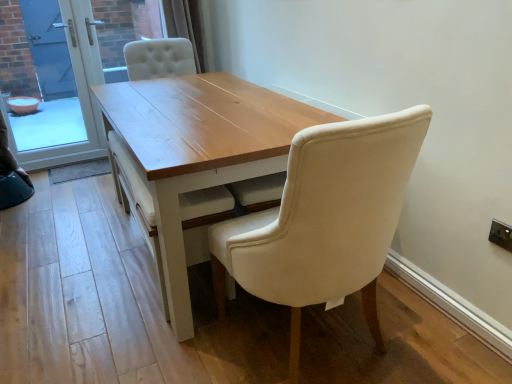
Question: Considering the relative sizes of blue glass screen door at left, which is the 2th screen door from right to left, and light wood table at center in the image provided, is blue glass screen door at left, which is the 2th screen door from right to left, thinner than light wood table at center?

Choices:
 (A) yes
 (B) no

Answer: (A)

Question: Is blue glass screen door at left, which is the 2th screen door from right to left, to the right of light wood table at center from the viewer's perspective?

Choices:
 (A) yes
 (B) no

Answer: (B)

Question: Would you say blue glass screen door at left, arranged as the first screen door when viewed from the left, is outside light wood table at center?

Choices:
 (A) no
 (B) yes

Answer: (B)

Question: From the image's perspective, would you say blue glass screen door at left, which is the 2th screen door from right to left, is shown under light wood table at center?

Choices:
 (A) no
 (B) yes

Answer: (A)

Question: Is blue glass screen door at left, which is the 2th screen door from right to left, with light wood table at center?

Choices:
 (A) no
 (B) yes

Answer: (A)

Question: Would you say transparent glass screen door at upper left, which is the first screen door from right to left, is to the left or to the right of blue glass screen door at left, arranged as the first screen door when viewed from the left, in the picture?

Choices:
 (A) right
 (B) left

Answer: (A)

Question: Is point (83, 89) closer or farther from the camera than point (100, 72)?

Choices:
 (A) closer
 (B) farther

Answer: (A)

Question: Based on their sizes in the image, would you say transparent glass screen door at upper left, which is the first screen door from right to left, is bigger or smaller than blue glass screen door at left, arranged as the first screen door when viewed from the left?

Choices:
 (A) small
 (B) big

Answer: (B)

Question: Considering the positions of transparent glass screen door at upper left, arranged as the second screen door when viewed from the left, and blue glass screen door at left, arranged as the first screen door when viewed from the left, in the image, is transparent glass screen door at upper left, arranged as the second screen door when viewed from the left, taller or shorter than blue glass screen door at left, arranged as the first screen door when viewed from the left,?

Choices:
 (A) short
 (B) tall

Answer: (B)

Question: Is blue glass screen door at left, which is the 2th screen door from right to left, spatially inside transparent glass screen door at upper left, which is the first screen door from right to left, or outside of it?

Choices:
 (A) outside
 (B) inside

Answer: (B)

Question: In terms of width, does blue glass screen door at left, arranged as the first screen door when viewed from the left, look wider or thinner when compared to transparent glass screen door at upper left, arranged as the second screen door when viewed from the left?

Choices:
 (A) thin
 (B) wide

Answer: (A)

Question: In the image, is blue glass screen door at left, arranged as the first screen door when viewed from the left, positioned in front of or behind transparent glass screen door at upper left, which is the first screen door from right to left?

Choices:
 (A) behind
 (B) front

Answer: (B)

Question: From a real-world perspective, is blue glass screen door at left, which is the 2th screen door from right to left, positioned above or below transparent glass screen door at upper left, which is the first screen door from right to left?

Choices:
 (A) above
 (B) below

Answer: (A)

Question: From their relative heights in the image, would you say light wood table at center is taller or shorter than blue glass screen door at left, arranged as the first screen door when viewed from the left?

Choices:
 (A) short
 (B) tall

Answer: (A)

Question: In the image, is light wood table at center on the left side or the right side of blue glass screen door at left, which is the 2th screen door from right to left?

Choices:
 (A) left
 (B) right

Answer: (B)